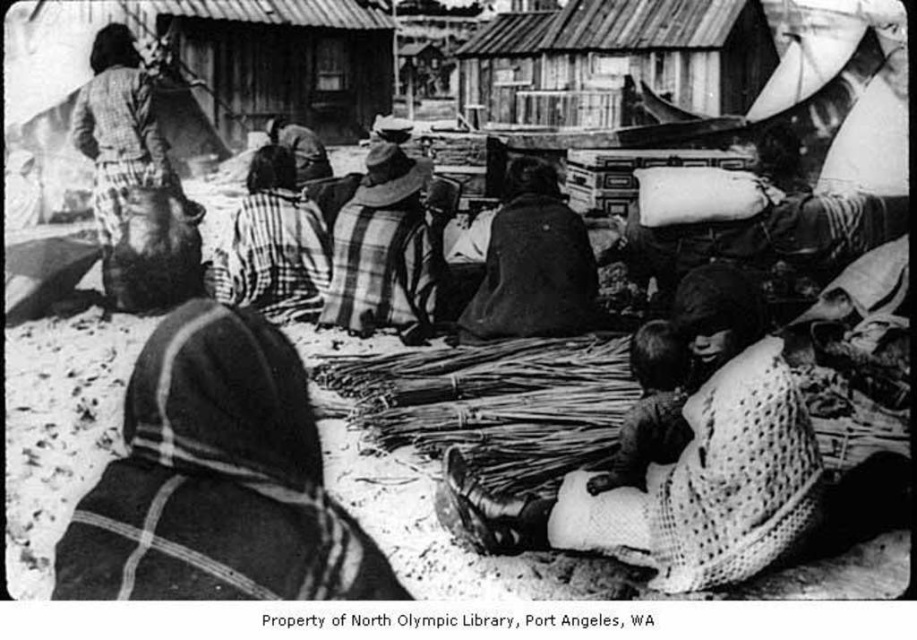
You are standing at the origin point in the image. Which of the two points, point (374,196) or point (507,205), is closer to you?

Point (507,205) is closer to you because it is in front of point (374,196).

Consider the image. You are an anthropologist studying traditional clothing. You observe the plaid fabric at center and the dark woolen shawl at center in the image. Which item is larger in size?

The dark woolen shawl at center is larger than the plaid fabric at center.